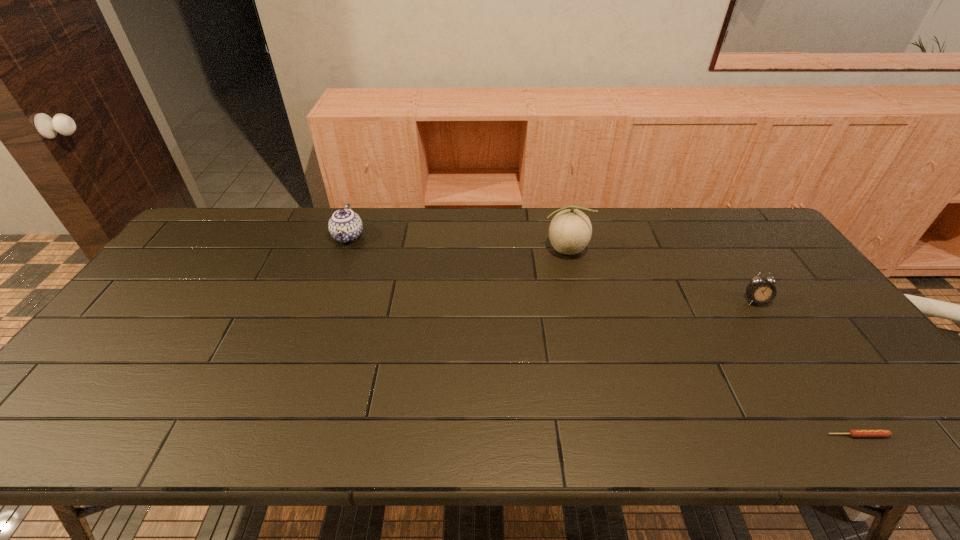
Identify the location of cantaloup. The height and width of the screenshot is (540, 960). (570, 231).

Find the location of `the third object from right to left`. the third object from right to left is located at coordinates [x=570, y=231].

Where is `the third shortest object`? the third shortest object is located at coordinates (345, 226).

The width and height of the screenshot is (960, 540). I want to click on the leftmost object, so click(345, 226).

Find the location of a particular element. The width and height of the screenshot is (960, 540). the third tallest object is located at coordinates (759, 290).

Image resolution: width=960 pixels, height=540 pixels. In order to click on the second nearest object in this screenshot , I will do `click(759, 290)`.

Locate an element on the screen. The height and width of the screenshot is (540, 960). the shortest object is located at coordinates (856, 433).

In order to click on the nearest object in this screenshot , I will do `click(856, 433)`.

Identify the location of free space located on the front of the cantaloup. (572, 281).

Where is `free space located 0.370m from the spout of the leftmost object`? The height and width of the screenshot is (540, 960). free space located 0.370m from the spout of the leftmost object is located at coordinates (308, 345).